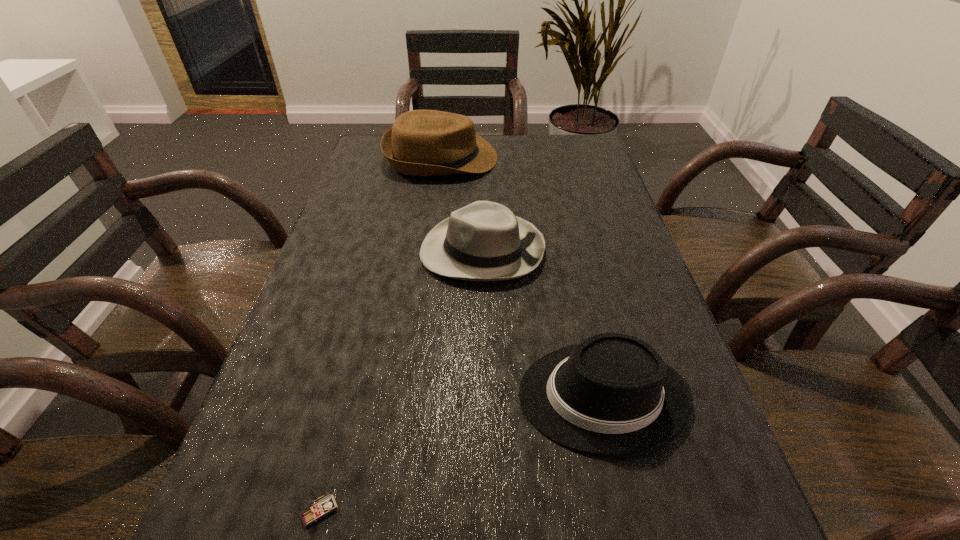
In the image, there is a desktop. Where is `blank space at the right edge`? blank space at the right edge is located at coordinates (583, 264).

The height and width of the screenshot is (540, 960). In order to click on free space between the third nearest object and the farthest object in this screenshot , I will do `click(462, 204)`.

Find the location of a particular element. The image size is (960, 540). free space between the farthest object and the third farthest object is located at coordinates (521, 277).

Locate an element on the screen. This screenshot has width=960, height=540. vacant area that lies between the second nearest fedora and the farthest fedora is located at coordinates (462, 204).

What are the coordinates of `vacant region between the second nearest object and the second farthest object` in the screenshot? It's located at (542, 323).

In order to click on vacant space in between the farthest object and the nearest fedora in this screenshot , I will do `click(521, 277)`.

Identify the location of vacant point located between the shortest object and the nearest fedora. (462, 454).

Locate an element on the screen. This screenshot has width=960, height=540. empty space between the matchbox and the second farthest object is located at coordinates (401, 381).

Image resolution: width=960 pixels, height=540 pixels. I want to click on vacant space that is in between the second farthest object and the third farthest object, so click(542, 323).

Identify the location of blank region between the shortest object and the second nearest object. (462, 454).